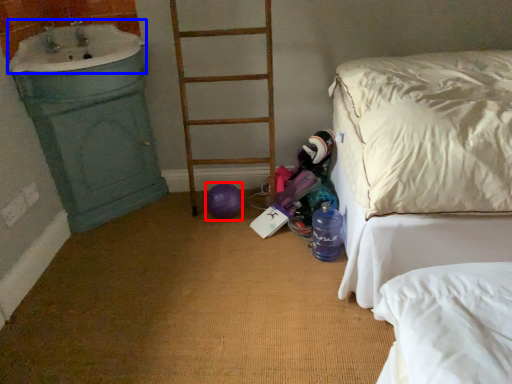
Question: Which point is closer to the camera, balloon (highlighted by a red box) or sink (highlighted by a blue box)?

Choices:
 (A) balloon
 (B) sink

Answer: (B)